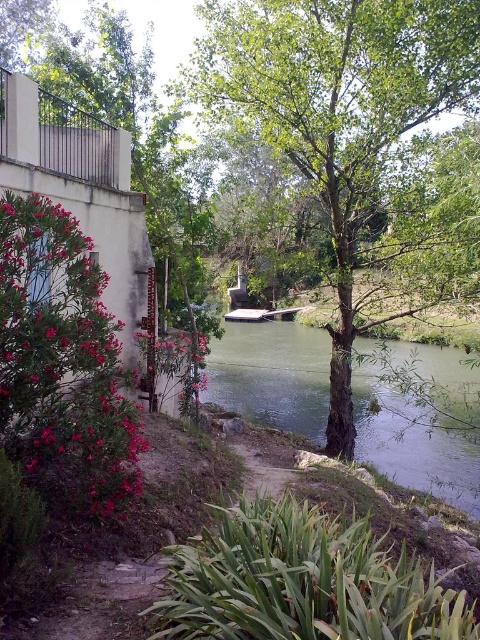
You are standing at the riverside and want to take a photo of the green leafy tree at center and the green leafy tree at upper center. Which tree should you focus on first if you want to capture the taller tree in your shot?

The green leafy tree at center is taller than the green leafy tree at upper center, so you should focus on the green leafy tree at center first to capture the taller tree in your shot.

You are standing at the point labeled point (162,144) and want to walk towards the point labeled point (425,365). Which direction should you move to get closer to your destination?

To move from point (162,144) towards point (425,365), you should move downward and to the right since point (425,365) is located at a lower and rightward position relative to point (162,144).

You are standing at the riverside and want to take a photo of the point at coordinates point (324, 202). If your camera has a maximum focus range of 15 meters, will it be able to focus on the point?

The distance of point (324, 202) from viewer is 16.14 meters, which exceeds the camera maximum focus range of 15 meters. Therefore, the camera cannot focus on the point.